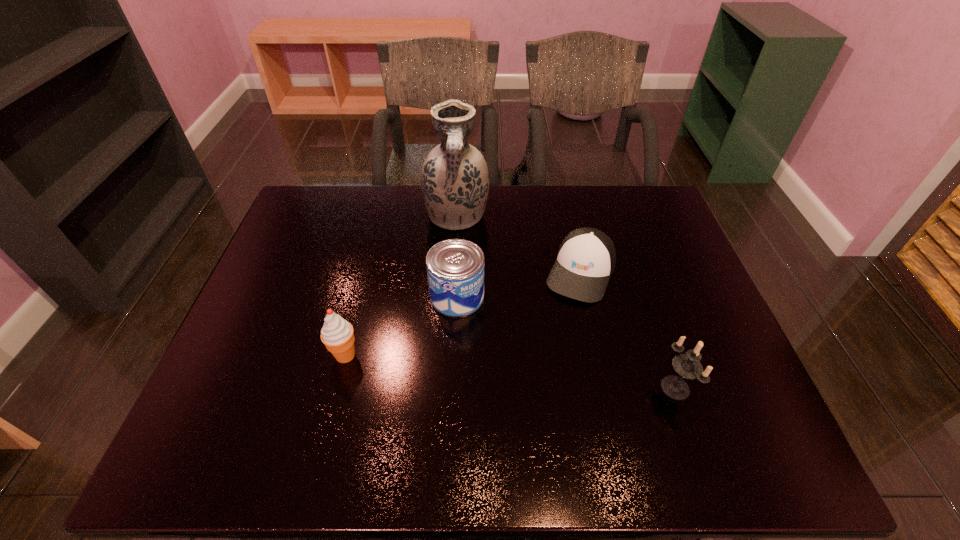
Identify the location of object that is at the far edge. The height and width of the screenshot is (540, 960). (455, 181).

Where is `object that is at the near edge`? object that is at the near edge is located at coordinates (688, 366).

The height and width of the screenshot is (540, 960). What are the coordinates of `object that is at the right edge` in the screenshot? It's located at (688, 366).

In order to click on object at the near right corner in this screenshot , I will do `click(688, 366)`.

The image size is (960, 540). I want to click on vacant space at the far edge, so click(x=603, y=185).

In the image, there is a desktop. Identify the location of blank space at the near edge. The height and width of the screenshot is (540, 960). (276, 416).

What are the coordinates of `free space at the left edge` in the screenshot? It's located at (288, 259).

I want to click on vacant space at the right edge of the desktop, so [644, 233].

The width and height of the screenshot is (960, 540). Find the location of `vacant region at the far right corner of the desktop`. vacant region at the far right corner of the desktop is located at coordinates (608, 188).

Find the location of a particular element. This screenshot has width=960, height=540. vacant area between the can and the shortest object is located at coordinates (518, 285).